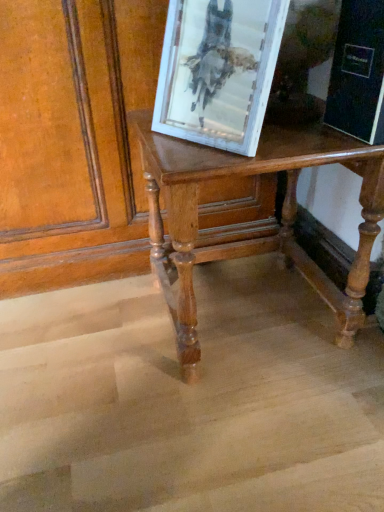
Question: Do you think shiny polished wood table at center is within white distressed wood picture frame at upper center, or outside of it?

Choices:
 (A) inside
 (B) outside

Answer: (B)

Question: Is shiny polished wood table at center bigger or smaller than white distressed wood picture frame at upper center?

Choices:
 (A) big
 (B) small

Answer: (A)

Question: Does point (317, 145) appear closer or farther from the camera than point (243, 40)?

Choices:
 (A) closer
 (B) farther

Answer: (B)

Question: Considering the positions of point (205, 128) and point (281, 231), is point (205, 128) closer or farther from the camera than point (281, 231)?

Choices:
 (A) closer
 (B) farther

Answer: (A)

Question: Looking at their shapes, would you say white distressed wood picture frame at upper center is wider or thinner than shiny polished wood table at center?

Choices:
 (A) thin
 (B) wide

Answer: (A)

Question: From the image's perspective, is white distressed wood picture frame at upper center positioned above or below shiny polished wood table at center?

Choices:
 (A) above
 (B) below

Answer: (A)

Question: Is white distressed wood picture frame at upper center in front of or behind shiny polished wood table at center in the image?

Choices:
 (A) behind
 (B) front

Answer: (B)